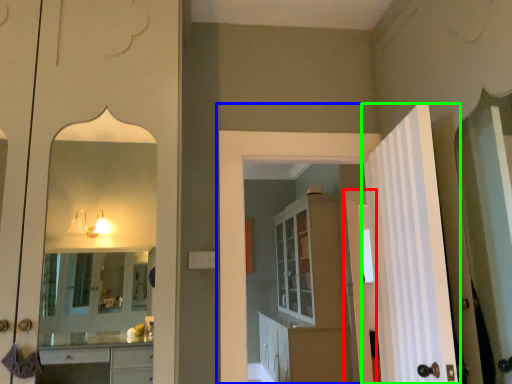
Question: Considering the real-world distances, which object is farthest from door (highlighted by a red box)? door (highlighted by a blue box) or door (highlighted by a green box)?

Choices:
 (A) door
 (B) door

Answer: (B)